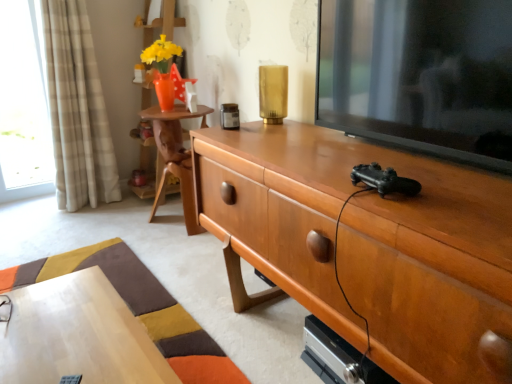
Question: Is woodenmaterial/texturebookshelf at upper left inside the boundaries of beige plaid curtain at left, or outside?

Choices:
 (A) outside
 (B) inside

Answer: (A)

Question: In the image, is woodenmaterial/texturebookshelf at upper left on the left side or the right side of beige plaid curtain at left?

Choices:
 (A) right
 (B) left

Answer: (A)

Question: Considering the real-world distances, which object is closest to the wooden side table at center?

Choices:
 (A) clear glass window at left
 (B) woodenmaterial/texturebookshelf at upper left
 (C) wooden cabinet at center
 (D) black glossy television at right
 (E) wooden desk at lower left

Answer: (B)

Question: Estimate the real-world distances between objects in this image. Which object is closer to the clear glass window at left?

Choices:
 (A) beige plaid curtain at left
 (B) black glossy television at right
 (C) wooden side table at center
 (D) woodenmaterial/texturebookshelf at upper left
 (E) wooden desk at lower left

Answer: (A)